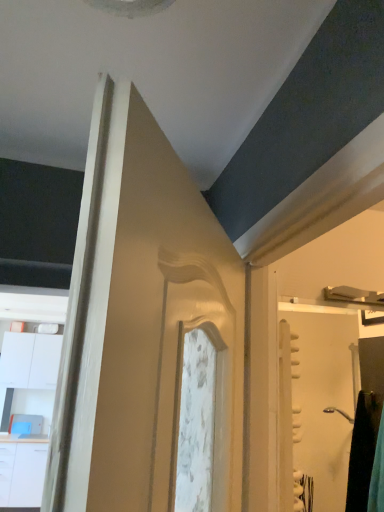
Identify the location of white glossy screen door at right. Image resolution: width=384 pixels, height=512 pixels. (324, 395).

Considering the sizes of white glossy drawer at lower left and white glossy cabinet at left in the image, is white glossy drawer at lower left bigger or smaller than white glossy cabinet at left?

In the image, white glossy drawer at lower left appears to be smaller than white glossy cabinet at left.

Is white glossy drawer at lower left touching white glossy cabinet at left?

white glossy drawer at lower left and white glossy cabinet at left are clearly separated.

From a real-world perspective, is white glossy drawer at lower left physically above white glossy cabinet at left?

No.

Is white glossy cabinet at left taller or shorter than white glossy screen door at right?

Considering their sizes, white glossy cabinet at left has more height than white glossy screen door at right.

How much distance is there between white glossy cabinet at left and white glossy screen door at right?

white glossy cabinet at left is 2.38 meters from white glossy screen door at right.

Are white glossy cabinet at left and white glossy screen door at right beside each other?

white glossy cabinet at left and white glossy screen door at right are clearly separated.

Consider the image. Relative to white glossy screen door at right, is white glossy cabinet at left in front or behind?

Visually, white glossy cabinet at left is located behind white glossy screen door at right.

Is white glossy cabinet at left at the right side of white glossy drawer at lower left?

Indeed, white glossy cabinet at left is positioned on the right side of white glossy drawer at lower left.

From the image's perspective, relative to white glossy drawer at lower left, is white glossy cabinet at left above or below?

From the image's perspective, white glossy cabinet at left appears above white glossy drawer at lower left.

The image size is (384, 512). Identify the location of dresser that is on the right side of white glossy drawer at lower left. (30, 373).

Which of these two, white glossy drawer at lower left or white glossy screen door at right, stands taller?

white glossy drawer at lower left.

Would you say white glossy screen door at right is part of white glossy drawer at lower left's contents?

No, white glossy screen door at right is not surrounded by white glossy drawer at lower left.

Which of these two, white glossy drawer at lower left or white glossy screen door at right, is bigger?

white glossy drawer at lower left.

From a real-world perspective, is white glossy drawer at lower left located beneath white glossy screen door at right?

Yes.

Is point (331, 423) farther from camera compared to point (21, 357)?

That is True.

Is white glossy cabinet at left inside white glossy screen door at right?

No, white glossy screen door at right does not contain white glossy cabinet at left.

Which is more to the right, white glossy screen door at right or white glossy cabinet at left?

Positioned to the right is white glossy screen door at right.

Is white glossy screen door at right in front of white glossy cabinet at left?

Yes, white glossy screen door at right is in front of white glossy cabinet at left.

Is white glossy screen door at right taller than white glossy drawer at lower left?

Incorrect, the height of white glossy screen door at right is not larger of that of white glossy drawer at lower left.

Is white glossy screen door at right situated inside white glossy drawer at lower left or outside?

white glossy screen door at right is located beyond the bounds of white glossy drawer at lower left.

Is the position of white glossy screen door at right more distant than that of white glossy drawer at lower left?

No, white glossy screen door at right is closer to the viewer.

Locate an element on the screen. dresser behind the white glossy drawer at lower left is located at coordinates 30,373.

Identify the location of dresser that is under the white glossy screen door at right (from a real-world perspective). This screenshot has height=512, width=384. (30, 373).

Considering their positions, is white glossy screen door at right positioned closer to white glossy drawer at lower left than white glossy cabinet at left?

white glossy cabinet at left is positioned closer to the anchor white glossy drawer at lower left.

From the image, which object appears to be nearer to white glossy cabinet at left, white glossy drawer at lower left or white glossy screen door at right?

white glossy drawer at lower left lies closer to white glossy cabinet at left than the other object.

Based on their spatial positions, is white glossy cabinet at left or white glossy drawer at lower left closer to white glossy screen door at right?

white glossy cabinet at left is positioned closer to the anchor white glossy screen door at right.

Considering their positions, is white glossy cabinet at left positioned closer to white glossy drawer at lower left than white glossy screen door at right?

The object closer to white glossy drawer at lower left is white glossy cabinet at left.

When comparing their distances from white glossy screen door at right, does white glossy drawer at lower left or white glossy cabinet at left seem further?

white glossy drawer at lower left is further to white glossy screen door at right.

Which object lies nearer to the anchor point white glossy cabinet at left, white glossy screen door at right or white glossy drawer at lower left?

Among the two, white glossy drawer at lower left is located nearer to white glossy cabinet at left.

You are a GUI agent. You are given a task and a screenshot of the screen. Output one action in this format:
    pyautogui.click(x=<x>, y=<y>)
    Task: Click on the drawer between white glossy screen door at right and white glossy cabinet at left in the front-back direction
    
    Given the screenshot: What is the action you would take?
    pyautogui.click(x=22, y=474)